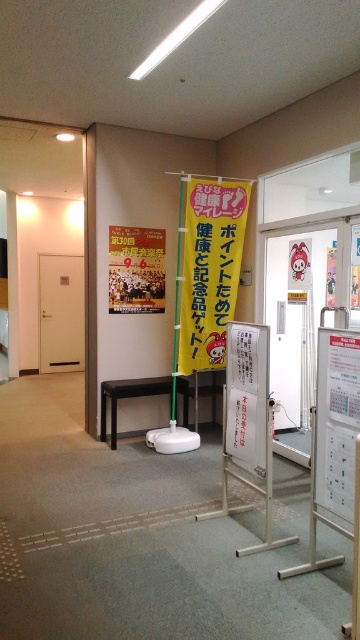
Consider the image. You are standing in the hallway and want to hang a new poster. The white paperboard at center is currently holding some notices, while the yellow paper poster at center is already displayed. Which one is easier to reach without moving any furniture?

The white paperboard at center is closer to the viewer than the yellow paper poster at center, so it is easier to reach without moving any furniture.

Based on the photo, you are a maintenance worker needing to move a 24 inch wide box from the yellow fabric banner at center to the black glossy stool at center. Can you move it without tilting the box sideways?

The distance between the yellow fabric banner at center and the black glossy stool at center is 39.06 inches. Since the box is 24 inches wide, it can be moved sideways without tilting as the available space is wider than the box.

You are standing in the hallway and want to hang a new poster. The yellow fabric banner at center is in your way. Can you move the black glossy stool at center to access the area behind the banner?

The yellow fabric banner at center is closer to the viewer than the black glossy stool at center, so the banner is blocking the area behind it. Moving the black glossy stool at center won